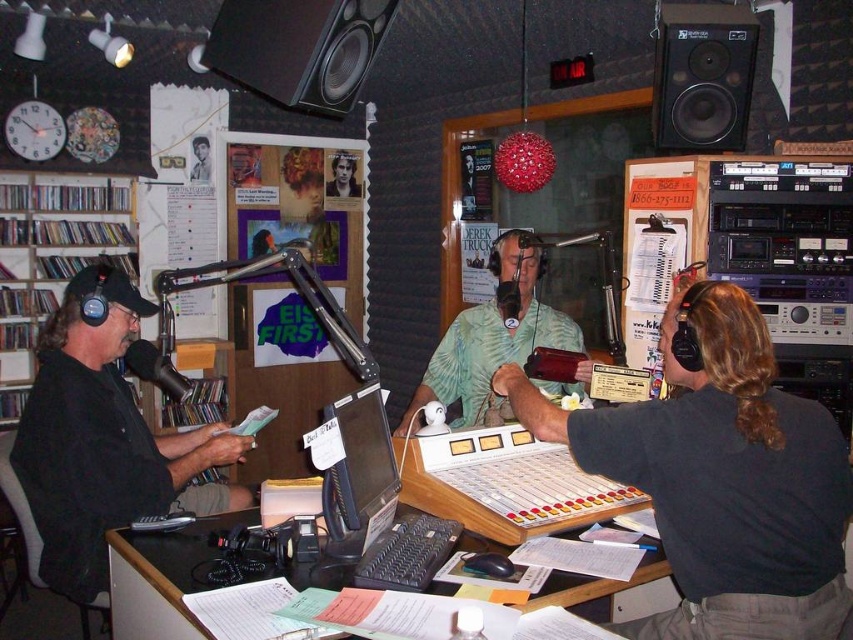
Question: Among these points, which one is nearest to the camera?

Choices:
 (A) (358, 406)
 (B) (207, 44)
 (C) (689, 10)

Answer: (A)

Question: Based on their relative distances, which object is nearer to the smooth skin face at center?

Choices:
 (A) wooden desk at center
 (B) black matte speaker at upper center
 (C) green textured shirt at center

Answer: (C)

Question: Is wooden bookshelf at left in front of green military uniform at upper left?

Choices:
 (A) yes
 (B) no

Answer: (A)

Question: Is green textured shirt at center smaller than smooth skin face at center?

Choices:
 (A) yes
 (B) no

Answer: (B)

Question: Is dark gray shirt at center bigger than wooden desk at center?

Choices:
 (A) yes
 (B) no

Answer: (A)

Question: Which of the following is the farthest from the observer?

Choices:
 (A) (270, 67)
 (B) (689, 36)
 (C) (694, 582)

Answer: (B)